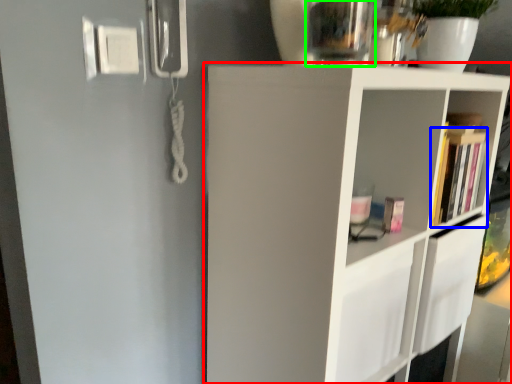
Question: Based on their relative distances, which object is nearer to shelf (highlighted by a red box)? Choose from book (highlighted by a blue box) and glass vase (highlighted by a green box).

Choices:
 (A) book
 (B) glass vase

Answer: (A)